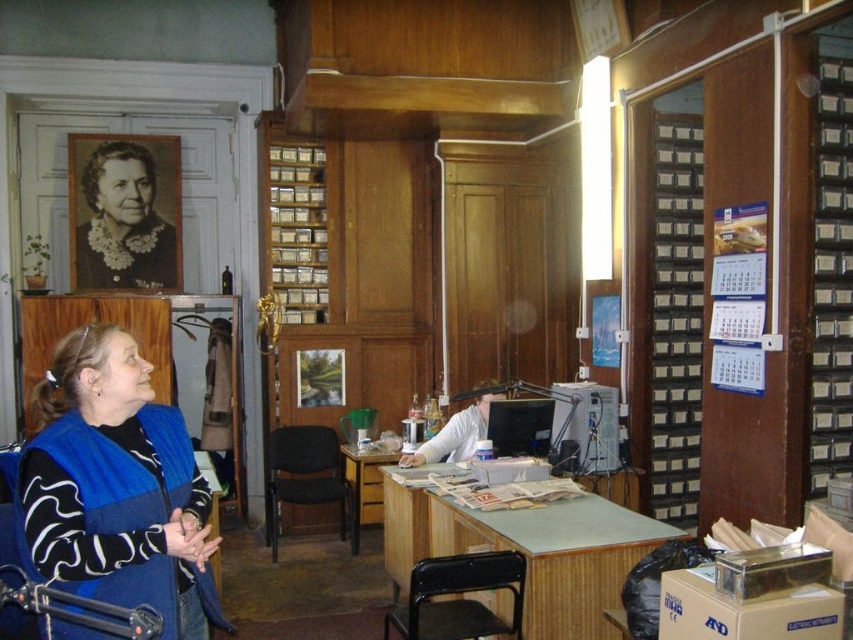
Consider the image. Can you confirm if blue fleece vest at left is positioned below black plastic chair at center?

Actually, blue fleece vest at left is above black plastic chair at center.

Does blue fleece vest at left have a greater height compared to black plastic chair at center?

Correct, blue fleece vest at left is much taller as black plastic chair at center.

The height and width of the screenshot is (640, 853). Identify the location of blue fleece vest at left. (117, 486).

Which is more to the right, blue fleece vest at left or wooden cabinet at right?

Positioned to the right is wooden cabinet at right.

Who is more distant from viewer, (61, 388) or (666, 124)?

The point (666, 124) is behind.

Which is behind, point (76, 481) or point (689, 192)?

The point (689, 192) is more distant.

Find the location of a particular element. The image size is (853, 640). blue fleece vest at left is located at coordinates (117, 486).

Between black plastic chair at center and light brown wooden desk at center, which one has less height?

light brown wooden desk at center

Between black plastic chair at center and light brown wooden desk at center, which one appears on the left side from the viewer's perspective?

Positioned to the left is black plastic chair at center.

Is point (340, 490) behind point (367, 476)?

That is False.

Find the location of a particular element. black plastic chair at center is located at coordinates (305, 476).